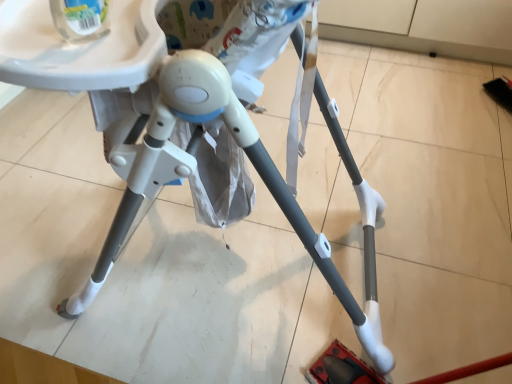
Where is `free point to the right of white plastic tripod at center`? This screenshot has height=384, width=512. free point to the right of white plastic tripod at center is located at coordinates (433, 200).